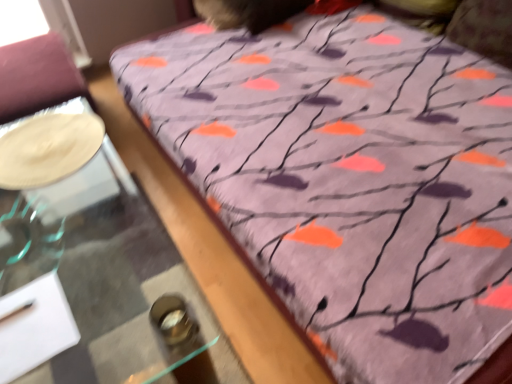
Question: Does white glossy plate at left turn towards transparent glass table at lower left?

Choices:
 (A) yes
 (B) no

Answer: (B)

Question: Is white glossy plate at left shorter than transparent glass table at lower left?

Choices:
 (A) no
 (B) yes

Answer: (B)

Question: Does white glossy plate at left appear on the left side of transparent glass table at lower left?

Choices:
 (A) yes
 (B) no

Answer: (A)

Question: Is the position of white glossy plate at left more distant than that of transparent glass table at lower left?

Choices:
 (A) no
 (B) yes

Answer: (B)

Question: Can transparent glass table at lower left be found inside white glossy plate at left?

Choices:
 (A) yes
 (B) no

Answer: (B)

Question: From the image's perspective, is white glossy plate at left located above transparent glass table at lower left?

Choices:
 (A) yes
 (B) no

Answer: (A)

Question: Does transparent glass table at lower left have a greater width compared to white glossy plate at left?

Choices:
 (A) no
 (B) yes

Answer: (B)

Question: Does transparent glass table at lower left lie behind white glossy plate at left?

Choices:
 (A) yes
 (B) no

Answer: (B)

Question: Would you say white glossy plate at left is part of transparent glass table at lower left's contents?

Choices:
 (A) no
 (B) yes

Answer: (A)

Question: Is transparent glass table at lower left bigger than white glossy plate at left?

Choices:
 (A) no
 (B) yes

Answer: (B)

Question: Is transparent glass table at lower left smaller than white glossy plate at left?

Choices:
 (A) yes
 (B) no

Answer: (B)

Question: From the image's perspective, is transparent glass table at lower left below white glossy plate at left?

Choices:
 (A) yes
 (B) no

Answer: (A)

Question: Is transparent glass table at lower left bigger or smaller than white glossy plate at left?

Choices:
 (A) small
 (B) big

Answer: (B)